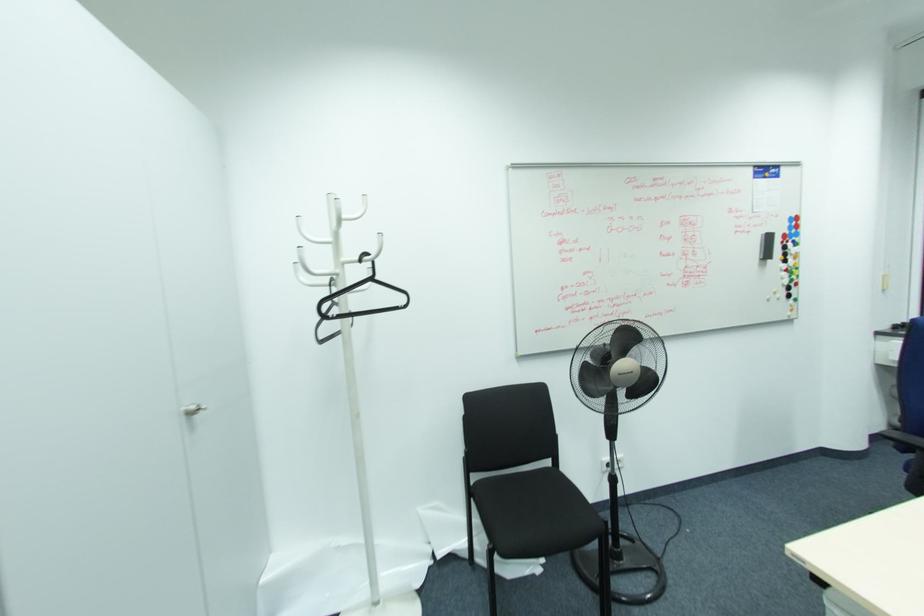
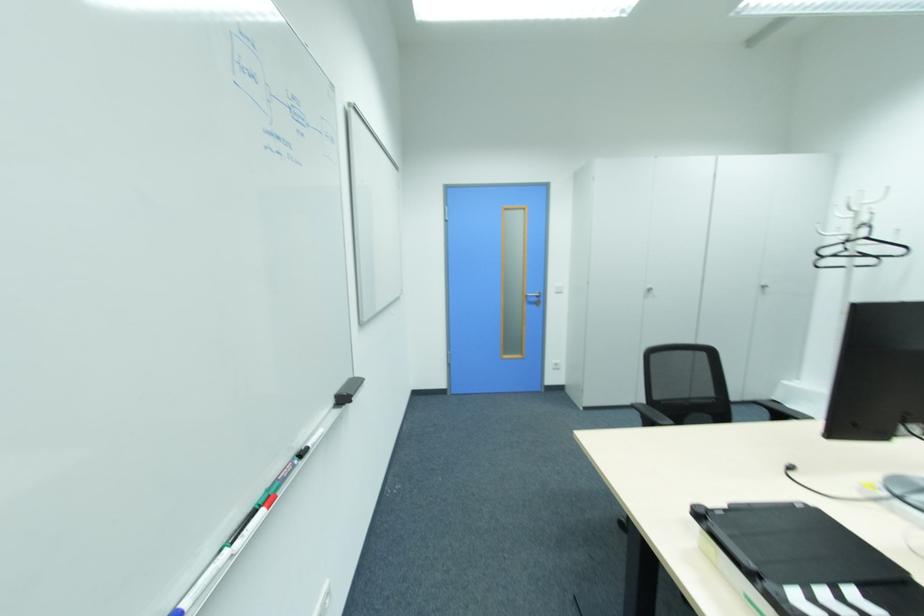
Locate, in the second image, the point that corresponds to [336,272] in the first image.

(849, 233)